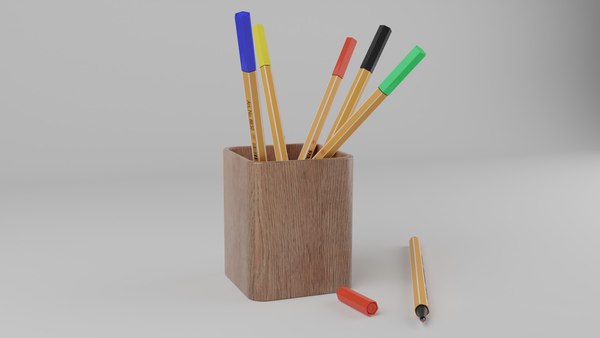
You are a GUI agent. You are given a task and a screenshot of the screen. Output one action in this format:
    pyautogui.click(x=<x>, y=<y>)
    Task: Click on the colored pens
    Image resolution: width=600 pixels, height=338 pixels.
    Given the screenshot: What is the action you would take?
    [420, 294], [394, 78], [363, 74], [331, 87], [271, 104], [250, 117]